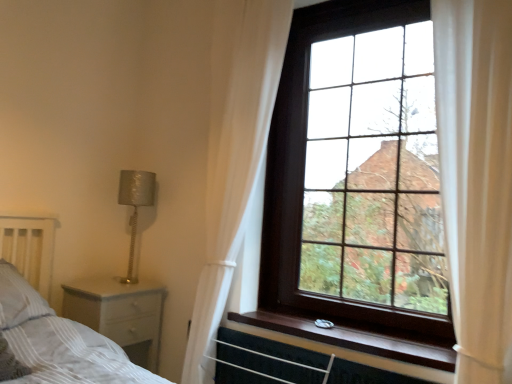
This screenshot has width=512, height=384. What do you see at coordinates (234, 154) in the screenshot? I see `white sheer curtain at upper right, arranged as the 2th curtain when viewed from the front` at bounding box center [234, 154].

Measure the distance between point [140,201] and camera.

They are 7.40 feet apart.

The width and height of the screenshot is (512, 384). Describe the element at coordinates (135, 206) in the screenshot. I see `silver textured lamp at left` at that location.

This screenshot has height=384, width=512. What do you see at coordinates (19, 299) in the screenshot?
I see `white striped pillow at lower left` at bounding box center [19, 299].

Describe the element at coordinates (357, 171) in the screenshot. The image size is (512, 384). I see `dark wood window at upper right` at that location.

Describe the element at coordinates (120, 314) in the screenshot. This screenshot has width=512, height=384. I see `white wood nightstand at lower left` at that location.

Locate an element on the screen. white sheer curtain at upper right, arranged as the 2th curtain when viewed from the front is located at coordinates (234, 154).

Is white wood nightstand at lower left aimed at white sheer curtain at upper right, which is the first curtain from back to front?

No, white wood nightstand at lower left is not facing towards white sheer curtain at upper right, which is the first curtain from back to front.

From a real-world perspective, is white wood nightstand at lower left physically located above or below white sheer curtain at upper right, which is the first curtain from back to front?

In terms of real-world spatial position, white wood nightstand at lower left is below white sheer curtain at upper right, which is the first curtain from back to front.

Considering the sizes of objects white wood nightstand at lower left and white sheer curtain at upper right, arranged as the 2th curtain when viewed from the front, in the image provided, who is wider, white wood nightstand at lower left or white sheer curtain at upper right, arranged as the 2th curtain when viewed from the front,?

A: With larger width is white wood nightstand at lower left.

Who is smaller, silver textured lamp at left or white wood nightstand at lower left?

silver textured lamp at left.

Is silver textured lamp at left aimed at white wood nightstand at lower left?

No, silver textured lamp at left is not oriented towards white wood nightstand at lower left.

Considering the positions of objects silver textured lamp at left and white wood nightstand at lower left in the image provided, who is in front, silver textured lamp at left or white wood nightstand at lower left?

white wood nightstand at lower left.

Between wooden at upper right and dark wood window at upper right, which one appears on the right side from the viewer's perspective?

Positioned to the right is dark wood window at upper right.

Considering the sizes of wooden at upper right and dark wood window at upper right in the image, is wooden at upper right wider or thinner than dark wood window at upper right?

Clearly, wooden at upper right has more width compared to dark wood window at upper right.

Can you tell me how much wooden at upper right and dark wood window at upper right differ in facing direction?

There is a 0.574-degree angle between the facing directions of wooden at upper right and dark wood window at upper right.

Is wooden at upper right beside dark wood window at upper right?

No.

From a real-world perspective, which object stands above the other?

white sheer curtain at upper right, arranged as the 2th curtain when viewed from the front.

From the picture: Is silver textured lamp at left oriented towards white sheer curtain at upper right, the 1th curtain from the left?

Yes, silver textured lamp at left is facing white sheer curtain at upper right, the 1th curtain from the left.

Which is nearer, (130,245) or (226,34)?

Clearly, point (130,245) is more distant from the camera than point (226,34).

Is silver textured lamp at left completely or partially outside of white sheer curtain at upper right, the 1th curtain from the left?

Yes, silver textured lamp at left is located beyond the bounds of white sheer curtain at upper right, the 1th curtain from the left.

Is white wood nightstand at lower left at the back of wooden at upper right?

No, wooden at upper right is not facing away from white wood nightstand at lower left.

Can you confirm if wooden at upper right is positioned to the left of white wood nightstand at lower left?

Incorrect, wooden at upper right is not on the left side of white wood nightstand at lower left.

Which of these two, wooden at upper right or white wood nightstand at lower left, is bigger?

Bigger between the two is white wood nightstand at lower left.

From a real-world perspective, who is located lower, wooden at upper right or white wood nightstand at lower left?

white wood nightstand at lower left is physically lower.

What's the angular difference between white wood nightstand at lower left and dark wood window at upper right's facing directions?

89.1 degrees.

Who is taller, white wood nightstand at lower left or dark wood window at upper right?

dark wood window at upper right is taller.

Does white wood nightstand at lower left have a lesser width compared to dark wood window at upper right?

Incorrect, the width of white wood nightstand at lower left is not less than that of dark wood window at upper right.

From the picture: Is white wood nightstand at lower left far from dark wood window at upper right?

That's right, there is a large distance between white wood nightstand at lower left and dark wood window at upper right.

Which object is closer to the camera taking this photo, white sheer curtain at upper right, placed as the 2th curtain when sorted from right to left, or dark wood window at upper right?

Positioned in front is dark wood window at upper right.

From a real-world perspective, is white sheer curtain at upper right, which is the first curtain from back to front, physically below dark wood window at upper right?

Indeed, from a real-world perspective, white sheer curtain at upper right, which is the first curtain from back to front, is positioned beneath dark wood window at upper right.

Between white sheer curtain at upper right, which is the first curtain from back to front, and dark wood window at upper right, which one appears on the right side from the viewer's perspective?

dark wood window at upper right is more to the right.

The height and width of the screenshot is (384, 512). What are the coordinates of `nightstand lying on the left of white sheer curtain at upper right, the 1th curtain from the left` in the screenshot? It's located at (120, 314).

The image size is (512, 384). Identify the location of nightstand in front of the silver textured lamp at left. (120, 314).

Considering their positions, is white striped pillow at lower left positioned further to dark wood window at upper right than white sheer curtain at right, the second curtain from the back?

white striped pillow at lower left.

Considering their positions, is silver textured lamp at left positioned further to white sheer curtain at right, placed as the 1th curtain when sorted from right to left, than dark wood window at upper right?

silver textured lamp at left is further to white sheer curtain at right, placed as the 1th curtain when sorted from right to left.

Estimate the real-world distances between objects in this image. Which object is closer to white sheer curtain at upper right, the 1th curtain from the left, white sheer curtain at right, positioned as the first curtain in front-to-back order, or white striped pillow at lower left?

white sheer curtain at right, positioned as the first curtain in front-to-back order, is closer to white sheer curtain at upper right, the 1th curtain from the left.

When comparing their distances from white sheer curtain at upper right, which is the first curtain from back to front, does white sheer curtain at right, the second curtain from the back, or silver textured lamp at left seem closer?

silver textured lamp at left lies closer to white sheer curtain at upper right, which is the first curtain from back to front, than the other object.

From the image, which object appears to be nearer to white sheer curtain at right, placed as the 1th curtain when sorted from right to left, white striped pillow at lower left or wooden at upper right?

The object closer to white sheer curtain at right, placed as the 1th curtain when sorted from right to left, is wooden at upper right.

Looking at the image, which one is located further to white wood nightstand at lower left, white sheer curtain at right, placed as the 1th curtain when sorted from right to left, or wooden at upper right?

white sheer curtain at right, placed as the 1th curtain when sorted from right to left, is further to white wood nightstand at lower left.

From the image, which object appears to be nearer to white wood nightstand at lower left, white sheer curtain at upper right, the 1th curtain from the left, or white striped pillow at lower left?

white striped pillow at lower left is closer to white wood nightstand at lower left.

Based on the photo, when comparing their distances from white sheer curtain at right, which is counted as the 2th curtain, starting from the left, does white sheer curtain at upper right, placed as the 2th curtain when sorted from right to left, or wooden at upper right seem further?

Based on the image, white sheer curtain at upper right, placed as the 2th curtain when sorted from right to left, appears to be further to white sheer curtain at right, which is counted as the 2th curtain, starting from the left.

Where is `window sill between white striped pillow at lower left and dark wood window at upper right`? The width and height of the screenshot is (512, 384). window sill between white striped pillow at lower left and dark wood window at upper right is located at coordinates (353, 339).

The height and width of the screenshot is (384, 512). I want to click on curtain between white wood nightstand at lower left and dark wood window at upper right in the horizontal direction, so click(234, 154).

Find the location of `lamp between white striped pillow at lower left and dark wood window at upper right`. lamp between white striped pillow at lower left and dark wood window at upper right is located at coordinates (135, 206).

Locate an element on the screen. The image size is (512, 384). curtain between silver textured lamp at left and wooden at upper right in the horizontal direction is located at coordinates (234, 154).